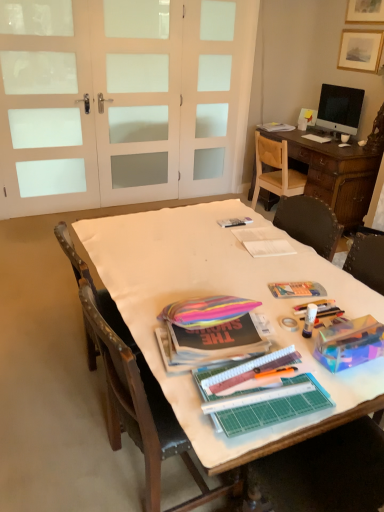
The height and width of the screenshot is (512, 384). I want to click on blank space situated above white fabric-covered table at center (from a real-world perspective), so click(231, 260).